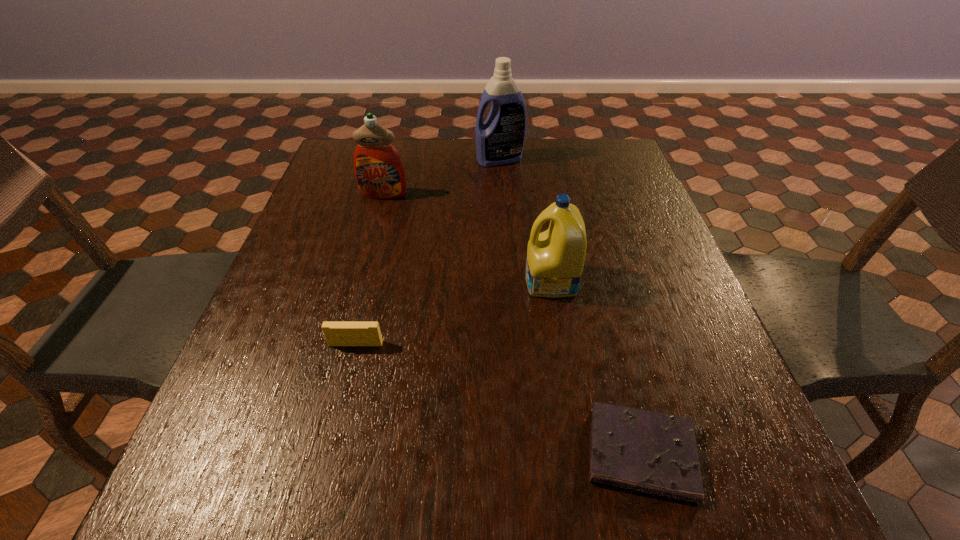
Locate which detergent ranks in proximity to the third nearest object. Please provide its 2D coordinates. Your answer should be formatted as a tuple, i.e. [(x, y)], where the tuple contains the x and y coordinates of a point satisfying the conditions above.

[(379, 171)]

The image size is (960, 540). Find the location of `the third closest detergent to the nearest object`. the third closest detergent to the nearest object is located at coordinates (500, 140).

You are a GUI agent. You are given a task and a screenshot of the screen. Output one action in this format:
    pyautogui.click(x=<x>, y=<y>)
    Task: Click on the vacant space that satisfies the following two spatial constraints: 1. on the front surface of the second farthest object; 2. on the left side of the nearest object
    
    Given the screenshot: What is the action you would take?
    pyautogui.click(x=314, y=454)

Locate an element on the screen. free point that satisfies the following two spatial constraints: 1. on the label of the nearest detergent; 2. on the right side of the shortest object is located at coordinates click(578, 454).

The width and height of the screenshot is (960, 540). Find the location of `vacant space that satisfies the following two spatial constraints: 1. on the front side of the diary; 2. on the right side of the farthest detergent`. vacant space that satisfies the following two spatial constraints: 1. on the front side of the diary; 2. on the right side of the farthest detergent is located at coordinates (517, 454).

Locate an element on the screen. free spot that satisfies the following two spatial constraints: 1. on the back side of the nearest object; 2. on the label of the third farthest object is located at coordinates (596, 281).

The image size is (960, 540). Identify the location of vacant space that satisfies the following two spatial constraints: 1. on the label of the shortest object; 2. on the left side of the third farthest object. (578, 454).

The height and width of the screenshot is (540, 960). I want to click on free space in the image that satisfies the following two spatial constraints: 1. at the front of the shortest object with spools; 2. on the left side of the second nearest object, so click(x=329, y=454).